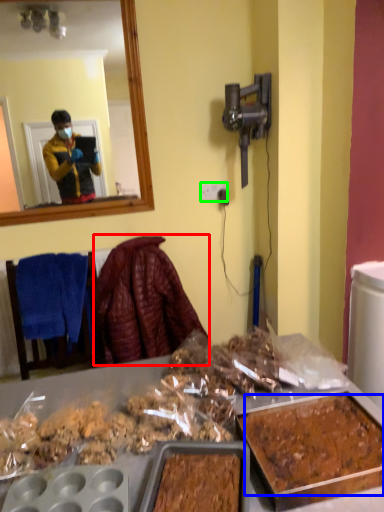
Question: Which object is positioned farthest from blanket (highlighted by a red box)? Select from food (highlighted by a blue box) and power outlet (highlighted by a green box).

Choices:
 (A) food
 (B) power outlet

Answer: (A)